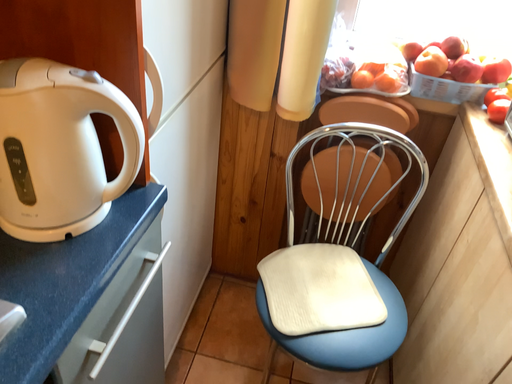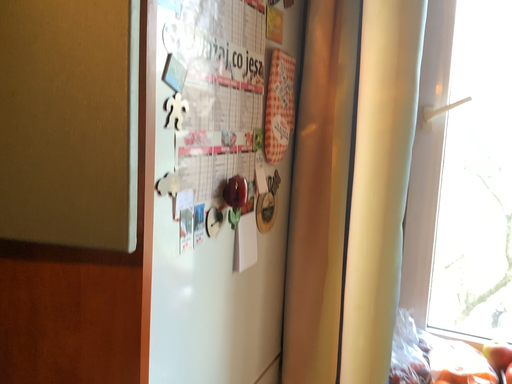
Question: Which way did the camera rotate in the video?

Choices:
 (A) rotated right
 (B) rotated left

Answer: (B)